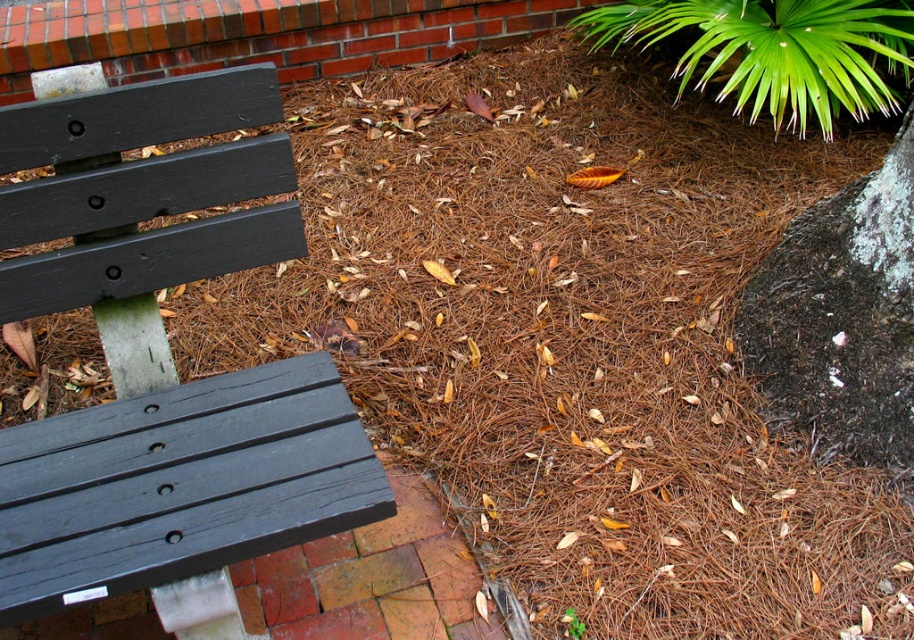
Does matte black bench at left lie in front of green leafy plant at upper right?

Yes, matte black bench at left is closer to the viewer.

How far apart are matte black bench at left and green leafy plant at upper right?

The distance of matte black bench at left from green leafy plant at upper right is 4.57 feet.

Does point (354, 516) lie in front of point (838, 16)?

That is True.

Find the location of a particular element. Image resolution: width=914 pixels, height=640 pixels. matte black bench at left is located at coordinates (162, 348).